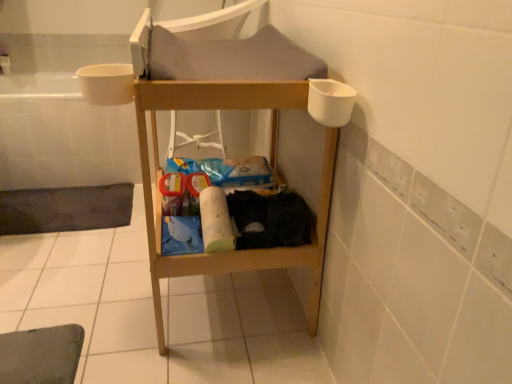
Describe the element at coordinates (65, 209) in the screenshot. I see `dark gray mesh bath mat at lower left` at that location.

The image size is (512, 384). What do you see at coordinates (62, 135) in the screenshot?
I see `white plastic bath at left` at bounding box center [62, 135].

This screenshot has width=512, height=384. I want to click on white matte toilet paper at center, so click(215, 221).

Consider the image. Considering the sizes of objects white matte toilet paper at center and white plastic bath at left in the image provided, who is smaller, white matte toilet paper at center or white plastic bath at left?

white matte toilet paper at center.

From the image's perspective, which is above, white matte toilet paper at center or white plastic bath at left?

From the image's view, white plastic bath at left is above.

Looking at this image, is white matte toilet paper at center oriented towards white plastic bath at left?

No, white matte toilet paper at center is not oriented towards white plastic bath at left.

From a real-world perspective, relative to dark gray mesh bath mat at lower left, is white plastic bath at left vertically above or below?

Clearly, from a real-world perspective, white plastic bath at left is above dark gray mesh bath mat at lower left.

Between white plastic bath at left and dark gray mesh bath mat at lower left, which one has larger width?

Wider between the two is white plastic bath at left.

Between white plastic bath at left and dark gray mesh bath mat at lower left, which one has smaller size?

With smaller size is dark gray mesh bath mat at lower left.

Is point (93, 129) farther from camera compared to point (126, 217)?

Yes, it is behind point (126, 217).

Is dark gray mesh bath mat at lower left directly adjacent to white matte toilet paper at center?

No, dark gray mesh bath mat at lower left is not with white matte toilet paper at center.

Considering the sizes of objects dark gray mesh bath mat at lower left and white matte toilet paper at center in the image provided, who is wider, dark gray mesh bath mat at lower left or white matte toilet paper at center?

Wider between the two is dark gray mesh bath mat at lower left.

Is dark gray mesh bath mat at lower left surrounding white matte toilet paper at center?

No.

Who is taller, white plastic bath at left or white matte toilet paper at center?

white plastic bath at left is taller.

From a real-world perspective, who is located higher, white plastic bath at left or white matte toilet paper at center?

white matte toilet paper at center, from a real-world perspective.

Does white plastic bath at left have a larger size compared to white matte toilet paper at center?

Yes.

Is white plastic bath at left positioned with its back to white matte toilet paper at center?

No, white plastic bath at left is not facing the opposite direction of white matte toilet paper at center.

Considering the relative sizes of white matte toilet paper at center and dark gray mesh bath mat at lower left in the image provided, is white matte toilet paper at center shorter than dark gray mesh bath mat at lower left?

Incorrect, the height of white matte toilet paper at center does not fall short of that of dark gray mesh bath mat at lower left.

Is white matte toilet paper at center to the left or to the right of dark gray mesh bath mat at lower left in the image?

Clearly, white matte toilet paper at center is on the right of dark gray mesh bath mat at lower left in the image.

Is white matte toilet paper at center not within dark gray mesh bath mat at lower left?

Yes, white matte toilet paper at center is outside of dark gray mesh bath mat at lower left.

From a real-world perspective, is dark gray mesh bath mat at lower left over white plastic bath at left?

Actually, dark gray mesh bath mat at lower left is physically below white plastic bath at left in the real world.

Considering the sizes of dark gray mesh bath mat at lower left and white plastic bath at left in the image, is dark gray mesh bath mat at lower left taller or shorter than white plastic bath at left?

dark gray mesh bath mat at lower left is shorter than white plastic bath at left.

Considering the sizes of dark gray mesh bath mat at lower left and white plastic bath at left in the image, is dark gray mesh bath mat at lower left wider or thinner than white plastic bath at left?

Considering their sizes, dark gray mesh bath mat at lower left looks slimmer than white plastic bath at left.

Considering the positions of objects dark gray mesh bath mat at lower left and white plastic bath at left in the image provided, who is more to the right, dark gray mesh bath mat at lower left or white plastic bath at left?

white plastic bath at left is more to the right.

In order to click on bath that is above the white matte toilet paper at center (from the image's perspective) in this screenshot , I will do `click(62, 135)`.

Identify the location of bath mat below the white plastic bath at left (from the image's perspective). The image size is (512, 384). (65, 209).

Based on their spatial positions, is white matte toilet paper at center or dark gray mesh bath mat at lower left further from white plastic bath at left?

white matte toilet paper at center.

Based on their spatial positions, is dark gray mesh bath mat at lower left or white plastic bath at left closer to white matte toilet paper at center?

Among the two, dark gray mesh bath mat at lower left is located nearer to white matte toilet paper at center.

Based on their spatial positions, is dark gray mesh bath mat at lower left or white matte toilet paper at center closer to white plastic bath at left?

dark gray mesh bath mat at lower left.

Which object lies nearer to the anchor point dark gray mesh bath mat at lower left, white matte toilet paper at center or white plastic bath at left?

white plastic bath at left is closer to dark gray mesh bath mat at lower left.

Which object lies further to the anchor point white matte toilet paper at center, white plastic bath at left or dark gray mesh bath mat at lower left?

white plastic bath at left.

Looking at the image, which one is located further to dark gray mesh bath mat at lower left, white plastic bath at left or white matte toilet paper at center?

white matte toilet paper at center is positioned further to the anchor dark gray mesh bath mat at lower left.

I want to click on bath mat between white matte toilet paper at center and white plastic bath at left from front to back, so click(65, 209).